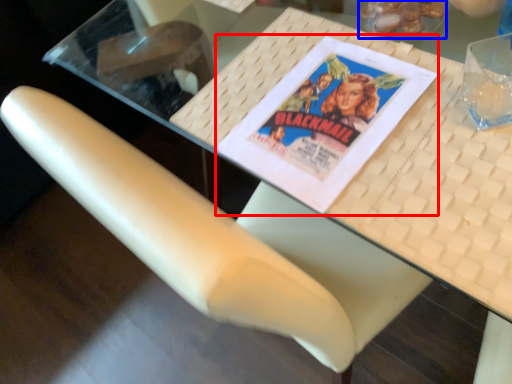
Question: Which object is closer to the camera taking this photo, paperback book (highlighted by a red box) or food (highlighted by a blue box)?

Choices:
 (A) paperback book
 (B) food

Answer: (A)